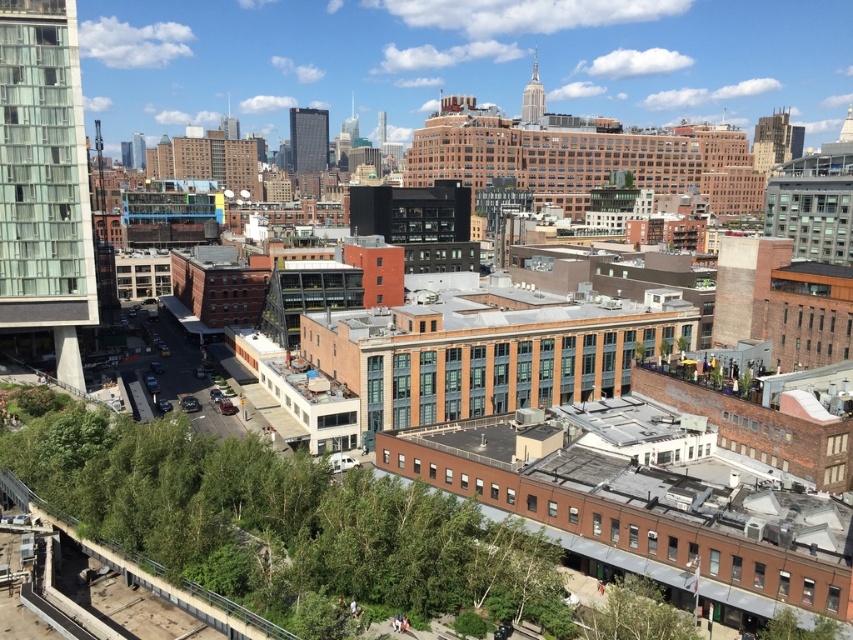
Question: Based on their relative distances, which object is farther from the matte brown building at upper right?

Choices:
 (A) green leafy tree at lower center
 (B) glassy reflective skyscraper at center

Answer: (A)

Question: Which point is farther from the camera taking this photo?

Choices:
 (A) (322, 145)
 (B) (650, 637)
 (C) (61, 154)
 (D) (769, 134)

Answer: (A)

Question: Which is nearer to the green leafy tree at lower center?

Choices:
 (A) glassy concrete building at left
 (B) glassy reflective skyscraper at center
 (C) matte brown building at upper right
 (D) matte glass skyscraper at upper center

Answer: (A)

Question: Does glassy reflective skyscraper at center appear on the right side of matte glass skyscraper at upper center?

Choices:
 (A) yes
 (B) no

Answer: (B)

Question: Considering the relative positions of glassy concrete building at left and matte glass skyscraper at upper center in the image provided, where is glassy concrete building at left located with respect to matte glass skyscraper at upper center?

Choices:
 (A) below
 (B) above

Answer: (A)

Question: Does green leafy tree at lower center appear over matte glass skyscraper at upper center?

Choices:
 (A) no
 (B) yes

Answer: (A)